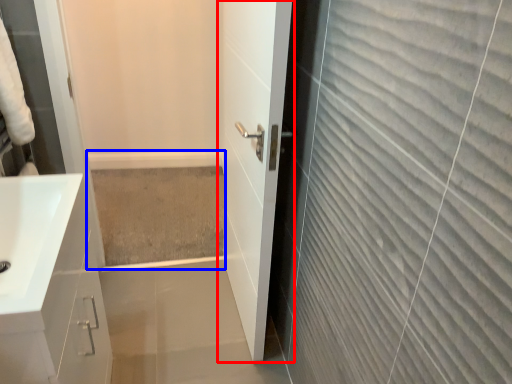
Question: Which point is closer to the camera, door (highlighted by a red box) or bath (highlighted by a blue box)?

Choices:
 (A) door
 (B) bath

Answer: (A)